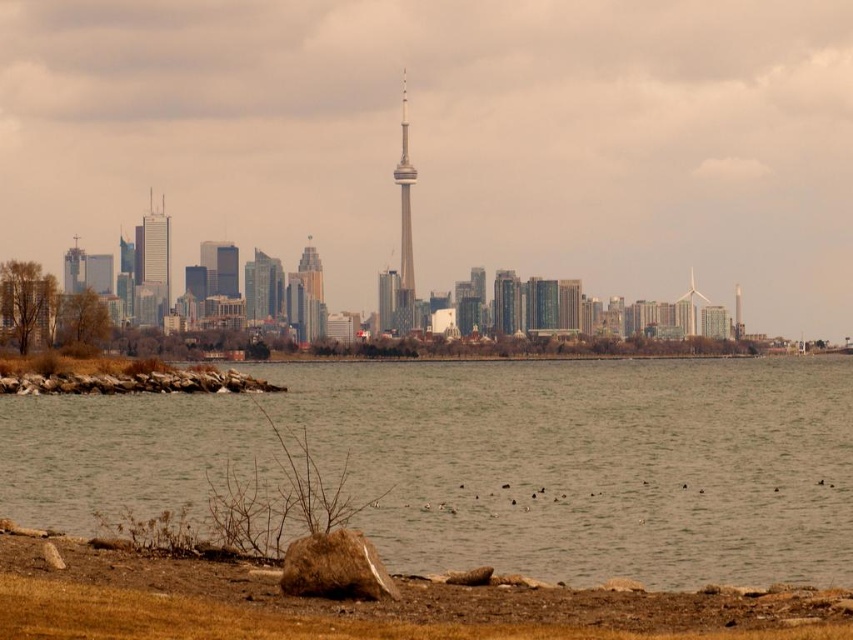
You are a photographer planning to capture the skyline of Toronto from the shoreline. You notice the brown water at lower center and the matte glass skyscraper at left. Which object should you focus on if you want to emphasize the reflection of the buildings in the water?

The brown water at lower center should be focused on because it is wider than the matte glass skyscraper at left, providing a larger surface to capture the reflections of the buildings.

You are standing on the shoreline and see the brown water at lower center and the gold reflective glass skyscraper at center. Which object is positioned to the right of the other?

The brown water at lower center is to the right of the gold reflective glass skyscraper at center.